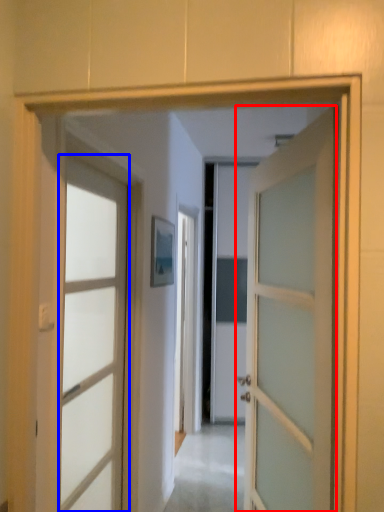
Question: Which point is further to the camera, door (highlighted by a red box) or door (highlighted by a blue box)?

Choices:
 (A) door
 (B) door

Answer: (B)